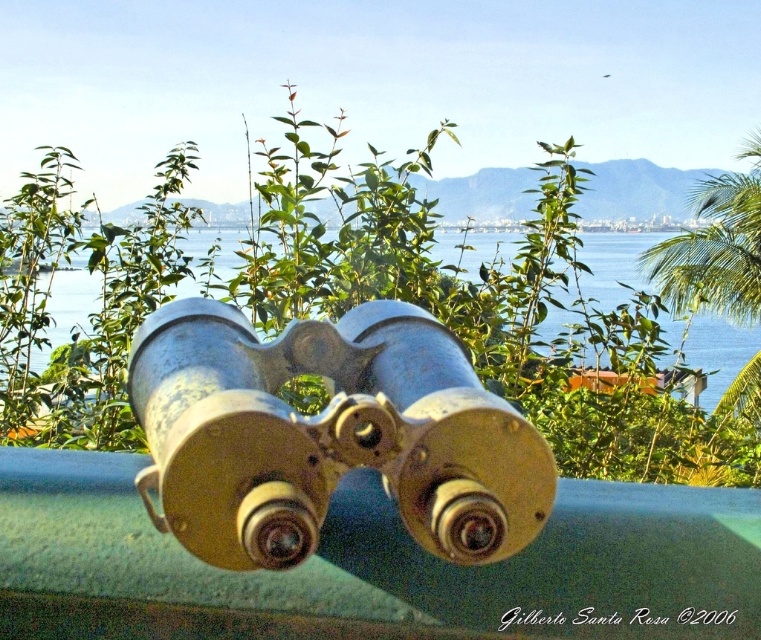
You are a photographer trying to capture the distant cityscape through the gold metallic binoculars at center. However, the green leafy palm tree at upper right is blocking your view. Can you determine if the binoculars are small enough to avoid obstruction from the palm tree?

The gold metallic binoculars at center has a smaller size compared to green leafy palm tree at upper right. Since the binoculars are smaller, they may be positioned in a way that allows you to adjust them to avoid the obstruction from the palm tree.

You are standing in a coastal area and see the gold metallic binoculars at center and the green leafy palm tree at upper right. Which object is taller when viewed from your current position?

The gold metallic binoculars at center has a lesser height compared to the green leafy palm tree at upper right, so the green leafy palm tree at upper right is taller.